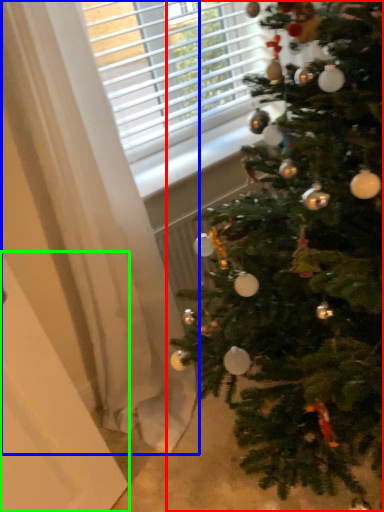
Question: Which object is the farthest from christmas tree (highlighted by a red box)? Choose among these: curtain (highlighted by a blue box) or screen door (highlighted by a green box).

Choices:
 (A) curtain
 (B) screen door

Answer: (B)